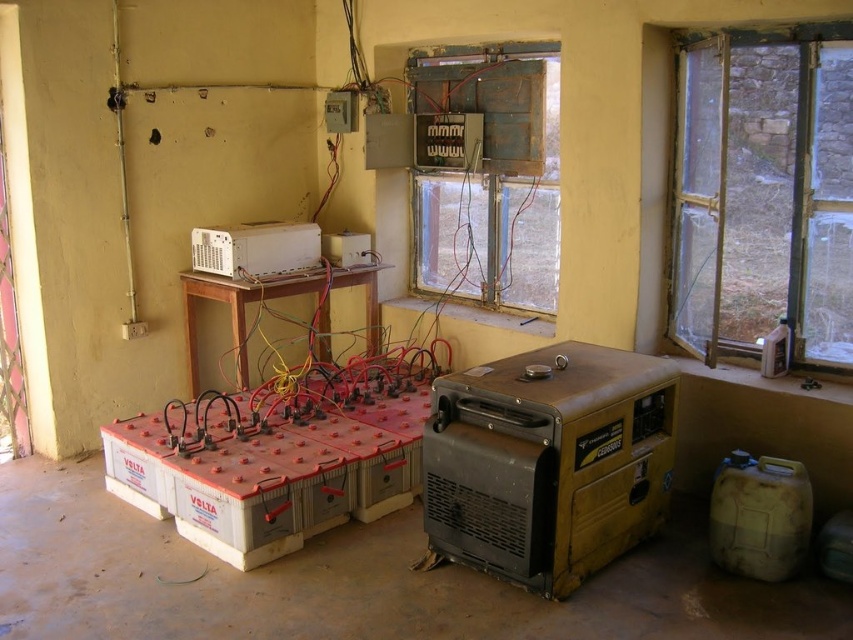
You are standing in the room and want to reach the white plastic microwave at upper center. Given that the room is 15 feet long, can you estimate whether the microwave is within the first half of the room or the second half?

The white plastic microwave at upper center is 12.68 feet away from the viewer. Since the room is 15 feet long, the first half of the room would be up to 7.5 feet. Therefore, the microwave is in the second half of the room.